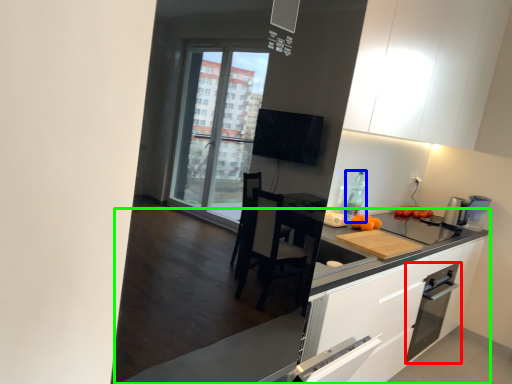
Question: Which is nearer to the kitchen appliance (highlighted by a red box)? bottle (highlighted by a blue box) or countertop (highlighted by a green box).

Choices:
 (A) bottle
 (B) countertop

Answer: (A)